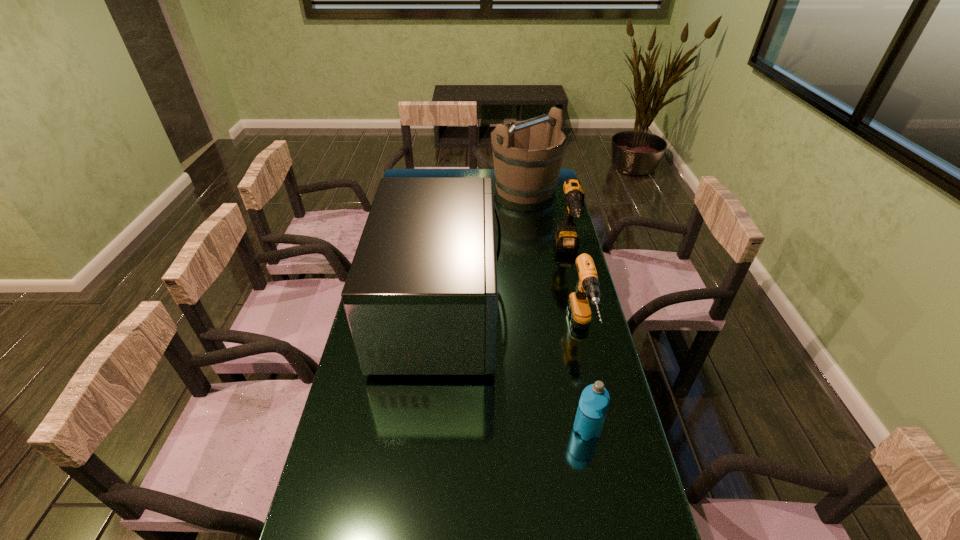
The width and height of the screenshot is (960, 540). Identify the location of vacant space located 0.090m on the left of the nearest object. (539, 429).

Locate an element on the screen. This screenshot has width=960, height=540. object positioned at the far edge is located at coordinates (523, 176).

The height and width of the screenshot is (540, 960). I want to click on object present at the left edge, so click(x=421, y=296).

Find the location of a particular element. bucket that is at the right edge is located at coordinates (523, 176).

This screenshot has width=960, height=540. Find the location of `thermos bottle located in the right edge section of the desktop`. thermos bottle located in the right edge section of the desktop is located at coordinates (594, 402).

Where is `object at the far right corner`? This screenshot has height=540, width=960. object at the far right corner is located at coordinates (523, 176).

Find the location of `vacant region at the left edge of the desktop`. vacant region at the left edge of the desktop is located at coordinates (358, 398).

I want to click on vacant space at the right edge, so click(531, 207).

Image resolution: width=960 pixels, height=540 pixels. I want to click on free space between the taller drill and the farthest object, so click(546, 220).

You are a GUI agent. You are given a task and a screenshot of the screen. Output one action in this format:
    pyautogui.click(x=<x>, y=<y>)
    Task: Click on the empty space that is in between the thermos bottle and the nearer drill
    
    Given the screenshot: What is the action you would take?
    pyautogui.click(x=585, y=380)